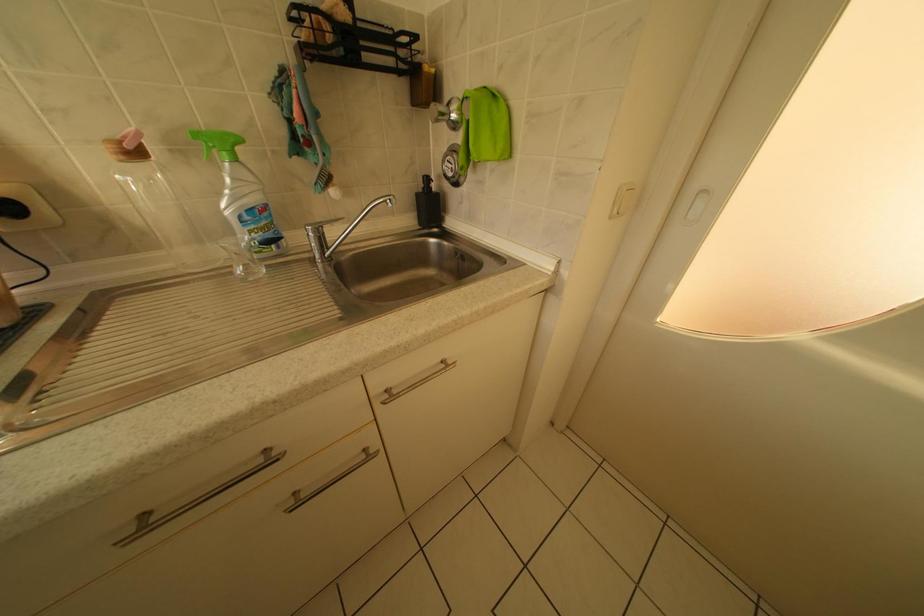
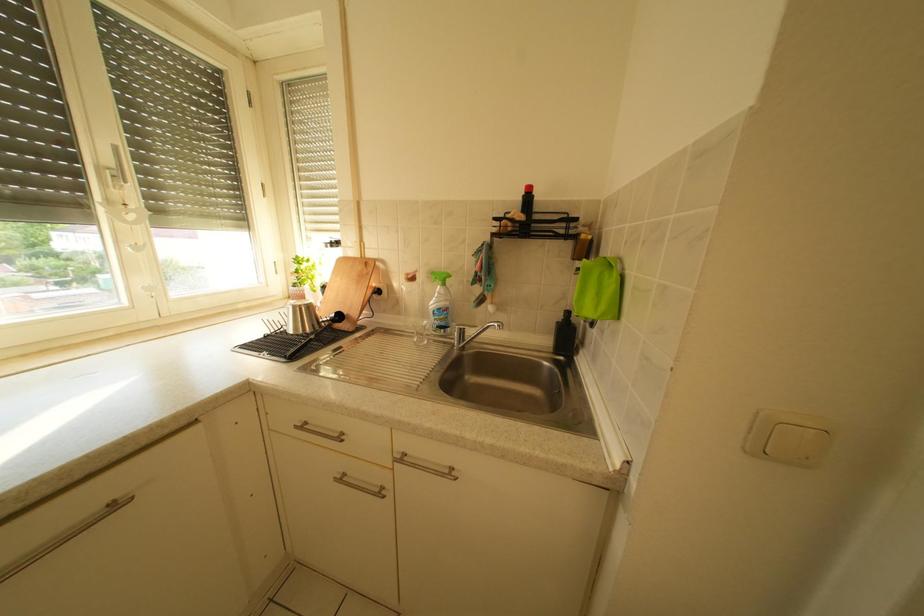
Question: Based on the continuous images, in which direction is the camera rotating? Reply with the corresponding letter.

Choices:
 (A) Left
 (B) Right
 (C) Up
 (D) Down

Answer: (A)